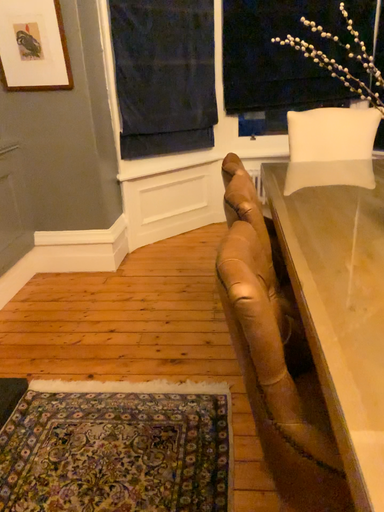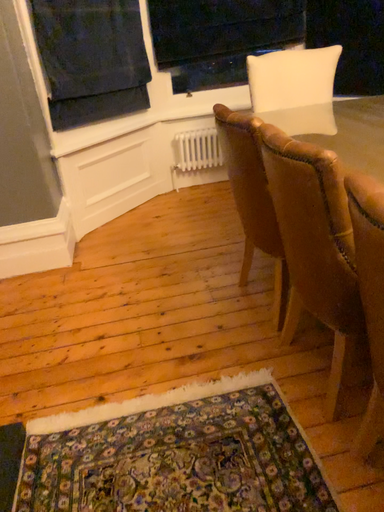
Question: How did the camera likely rotate when shooting the video?

Choices:
 (A) rotated left
 (B) rotated right

Answer: (B)